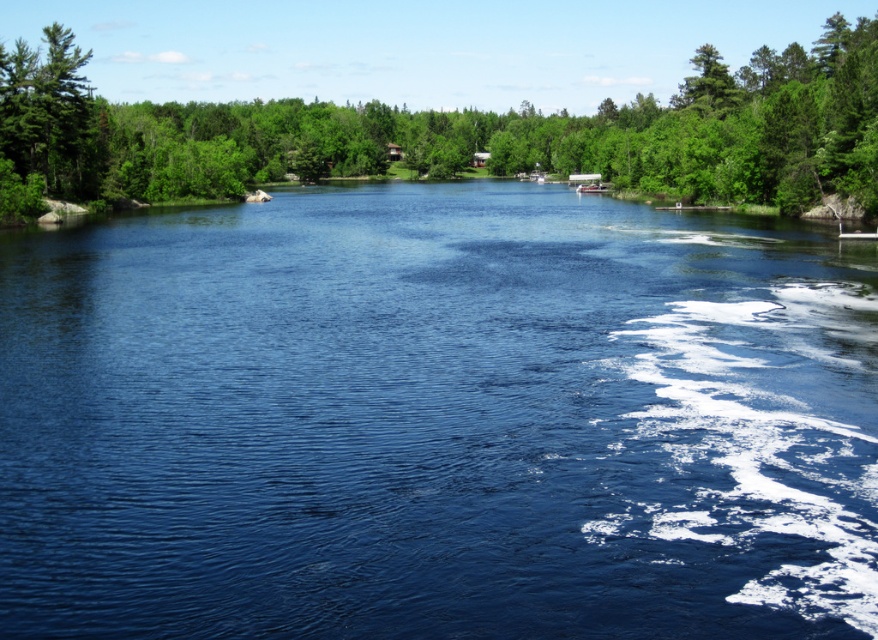
Question: Can you confirm if green leafy tree at upper center is thinner than green matte tree at upper left?

Choices:
 (A) no
 (B) yes

Answer: (A)

Question: Is green leafy tree at upper center wider than green matte tree at upper left?

Choices:
 (A) yes
 (B) no

Answer: (A)

Question: Which point is closer to the camera taking this photo?

Choices:
 (A) (94, 120)
 (B) (48, 134)
 (C) (613, 314)

Answer: (C)

Question: Can you confirm if blue water at center is smaller than green leafy tree at upper center?

Choices:
 (A) yes
 (B) no

Answer: (A)

Question: Which is nearer to the green leafy tree at upper center?

Choices:
 (A) blue water at center
 (B) green matte tree at upper left

Answer: (A)

Question: Which object is closer to the camera taking this photo?

Choices:
 (A) green matte tree at upper left
 (B) blue water at center

Answer: (B)